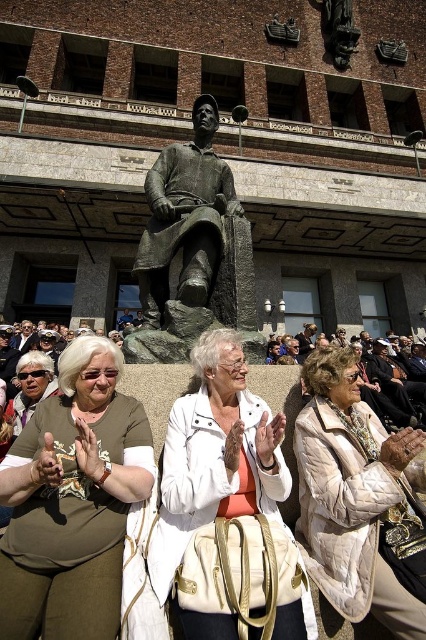
Can you confirm if white leather bag at center is bigger than bronze statue at center?

No, white leather bag at center is not bigger than bronze statue at center.

Where is `white leather bag at center`? Image resolution: width=426 pixels, height=640 pixels. white leather bag at center is located at coordinates (227, 509).

Measure the distance between beige quilted coat at center and bronze statue at center.

beige quilted coat at center is 6.18 meters away from bronze statue at center.

The width and height of the screenshot is (426, 640). I want to click on beige quilted coat at center, so [x=359, y=500].

Looking at this image, who is more forward, (334,346) or (198,307)?

Point (198,307)

Locate an element on the screen. The width and height of the screenshot is (426, 640). beige quilted coat at center is located at coordinates (359, 500).

Who is more forward, [178,296] or [25,412]?

Point [178,296]

Can you confirm if bronze statue at center is positioned to the right of matte brown jacket at lower left?

Yes, bronze statue at center is to the right of matte brown jacket at lower left.

Is point (213, 253) farther from viewer compared to point (28, 369)?

No.

In order to click on bronze statue at center in this screenshot , I will do `click(192, 250)`.